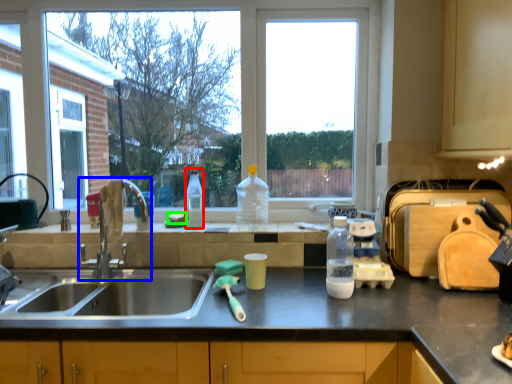
Question: Which is farther away from bottle (highlighted by a red box)? tap (highlighted by a blue box) or food (highlighted by a green box)?

Choices:
 (A) tap
 (B) food

Answer: (A)